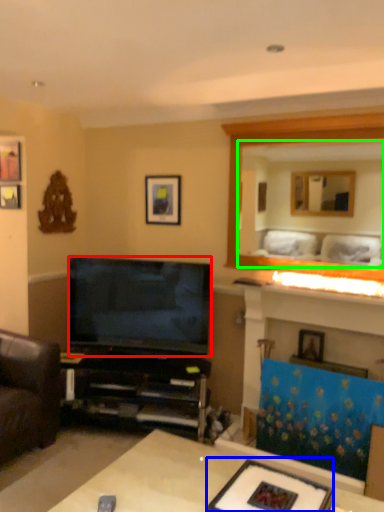
Question: Which object is positioned closest to television (highlighted by a red box)? Select from channel (highlighted by a blue box) and mirror (highlighted by a green box).

Choices:
 (A) channel
 (B) mirror

Answer: (A)